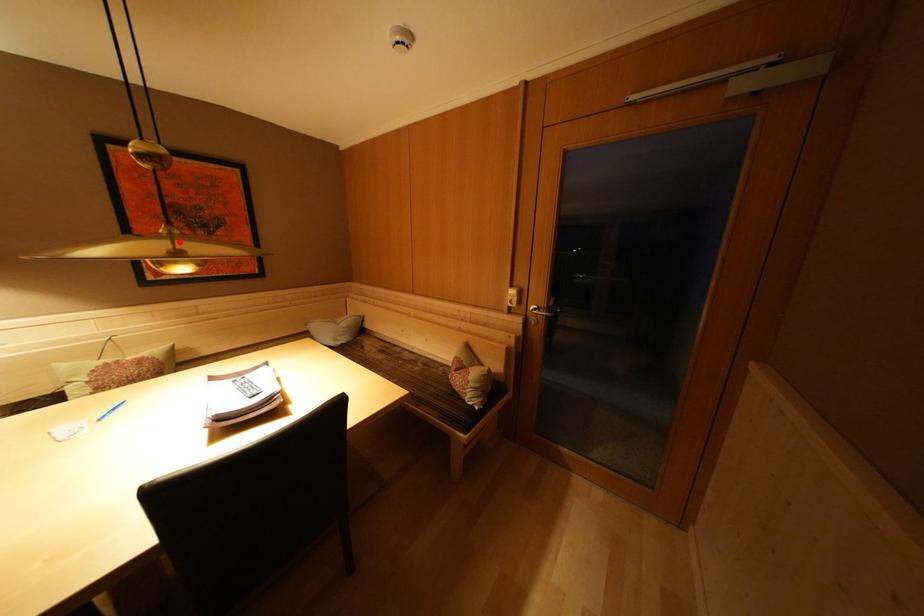
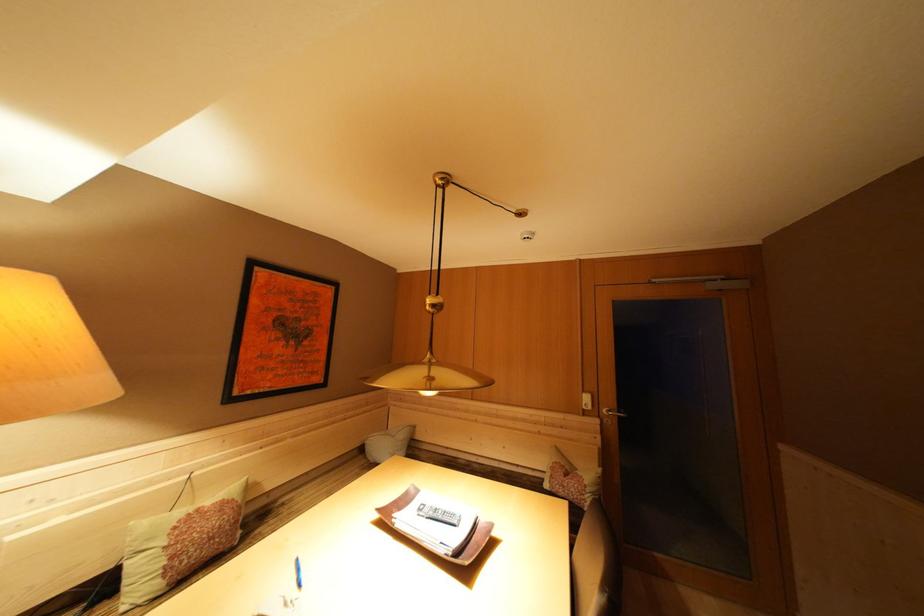
Where in the second image is the point corresponding to the highlighted location from the first image?

(438, 369)